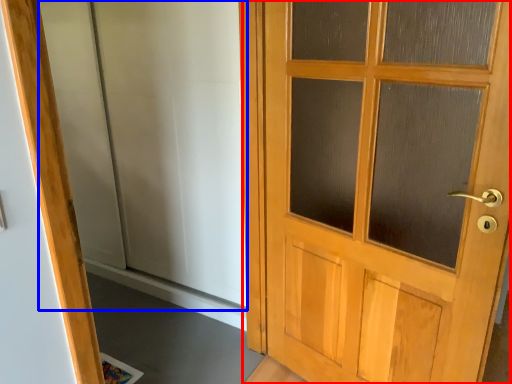
Question: Which object appears farthest to the camera in this image, door (highlighted by a red box) or elevator (highlighted by a blue box)?

Choices:
 (A) door
 (B) elevator

Answer: (B)